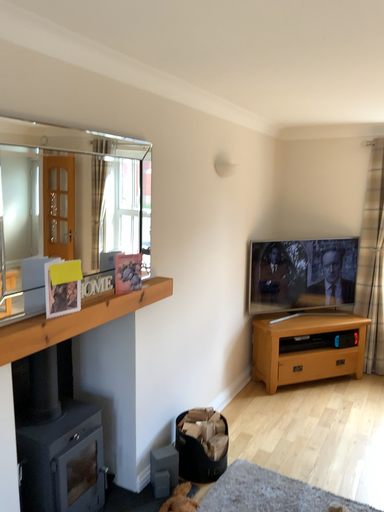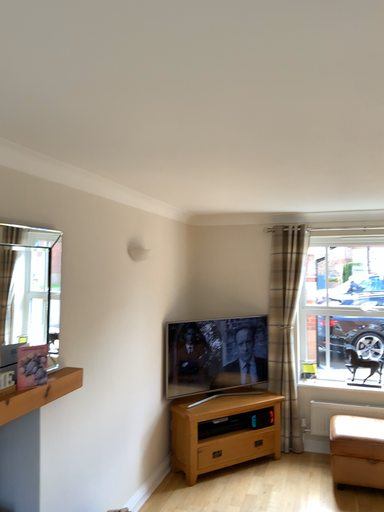
Question: Which way did the camera rotate in the video?

Choices:
 (A) rotated downward
 (B) rotated upward

Answer: (B)